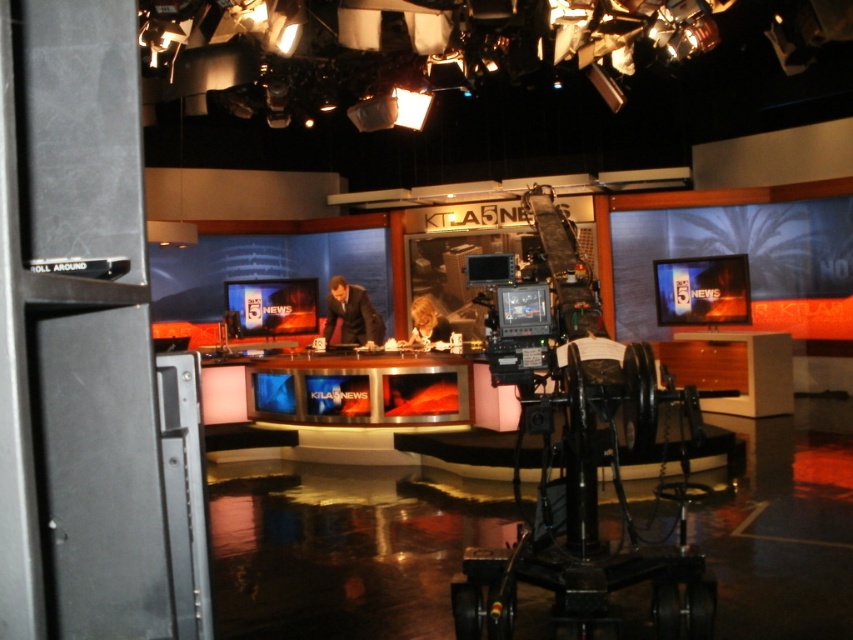
Question: Which point is closer to the camera?

Choices:
 (A) (543, 352)
 (B) (352, 298)

Answer: (A)

Question: Is black matte video camera at center below dark suit at center?

Choices:
 (A) no
 (B) yes

Answer: (A)

Question: Which of the following is the farthest from the observer?

Choices:
 (A) dark suit at center
 (B) black matte video camera at center

Answer: (A)

Question: Does black matte video camera at center appear over dark suit at center?

Choices:
 (A) yes
 (B) no

Answer: (A)

Question: Where is black matte video camera at center located in relation to dark suit at center in the image?

Choices:
 (A) above
 (B) below

Answer: (A)